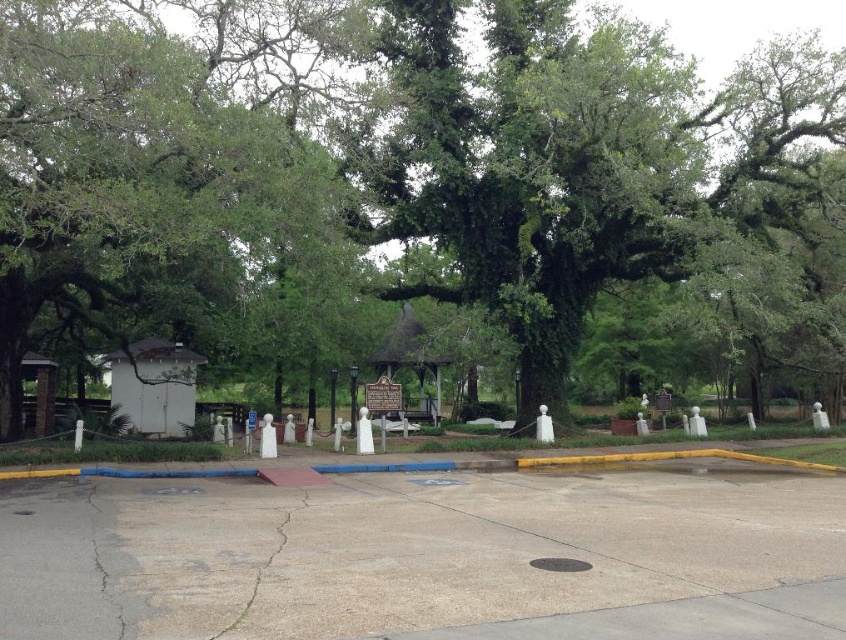
Question: Is green leafy tree at center smaller than gray concrete pavement at center?

Choices:
 (A) no
 (B) yes

Answer: (A)

Question: Which object appears farthest from the camera in this image?

Choices:
 (A) gray concrete pavement at center
 (B) green leafy tree at center

Answer: (B)

Question: Among these objects, which one is nearest to the camera?

Choices:
 (A) green leafy tree at center
 (B) gray concrete pavement at center

Answer: (B)

Question: In this image, where is green leafy tree at center located relative to gray concrete pavement at center?

Choices:
 (A) above
 (B) below

Answer: (A)

Question: Is green leafy tree at center further to the viewer compared to gray concrete pavement at center?

Choices:
 (A) yes
 (B) no

Answer: (A)